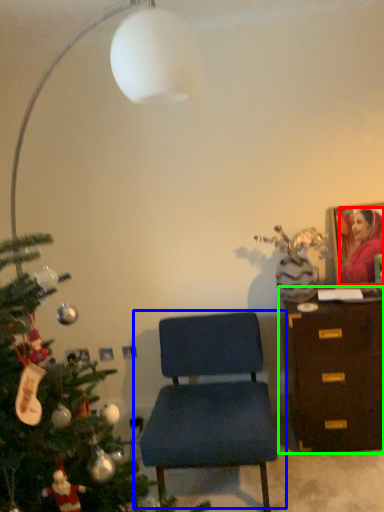
Question: Considering the real-world distances, which object is closest to person (highlighted by a red box)? chair (highlighted by a blue box) or chest of drawers (highlighted by a green box).

Choices:
 (A) chair
 (B) chest of drawers

Answer: (B)